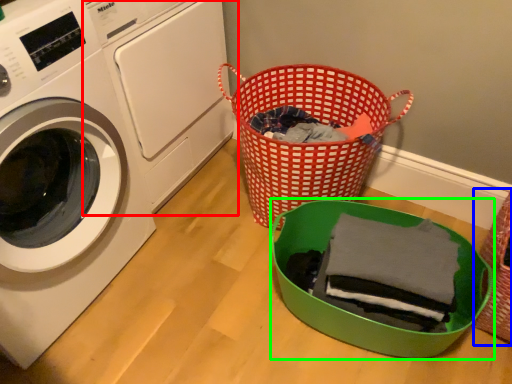
Question: Which is nearer to the washing machine (highlighted by a red box)? basket (highlighted by a blue box) or basket (highlighted by a green box).

Choices:
 (A) basket
 (B) basket

Answer: (B)